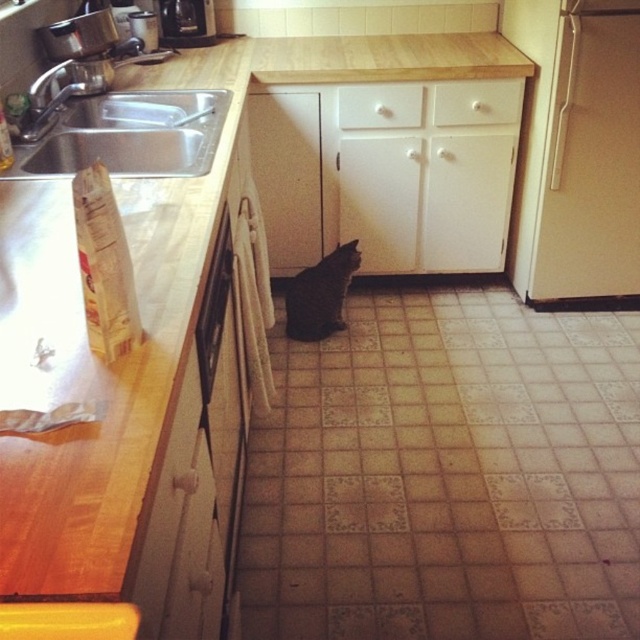
Is point (218, 104) farther from camera compared to point (388, 113)?

No, it is not.

The width and height of the screenshot is (640, 640). In order to click on stainless steel sink at left in this screenshot , I will do `click(129, 134)`.

Which is above, white matte refrigerator at right or white matte drawer at upper center?

white matte drawer at upper center is above.

In the scene shown: Which is more to the right, white matte refrigerator at right or white matte drawer at upper center?

white matte refrigerator at right

Is point (570, 221) farther from viewer compared to point (518, 90)?

Yes, it is behind point (518, 90).

At what (x,y) coordinates should I click in order to perform the action: click on white matte refrigerator at right. Please return your answer as a coordinate pair (x, y). This screenshot has width=640, height=640. Looking at the image, I should click on (577, 148).

Who is shorter, white matte drawer at upper center or white matte drawer at center?

white matte drawer at center is shorter.

Between white matte drawer at upper center and white matte drawer at center, which one appears on the left side from the viewer's perspective?

white matte drawer at center is more to the left.

Is point (465, 100) positioned after point (408, 115)?

No, (465, 100) is in front of (408, 115).

At what (x,y) coordinates should I click in order to perform the action: click on white matte drawer at upper center. Please return your answer as a coordinate pair (x, y). The height and width of the screenshot is (640, 640). Looking at the image, I should click on (477, 102).